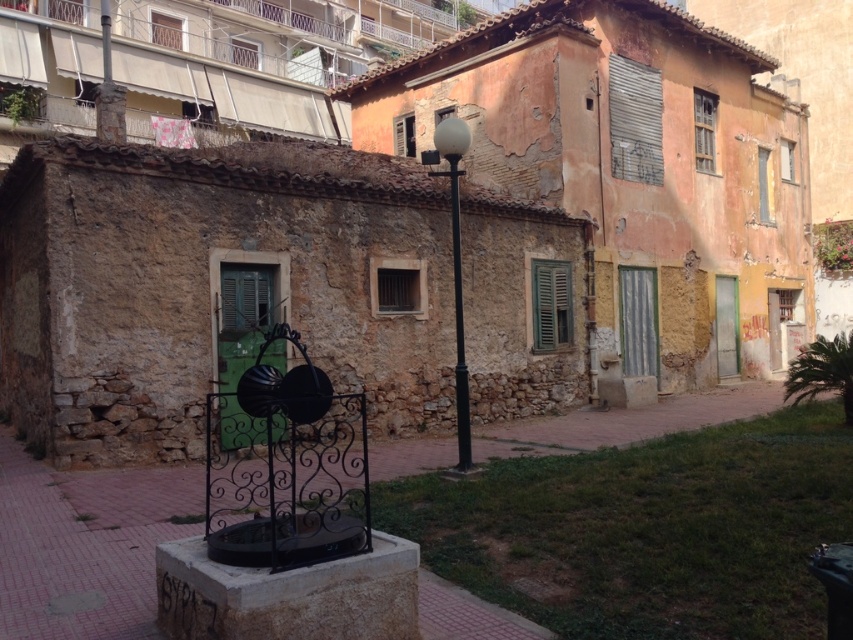
From the picture: You are standing in front of the weathered stone building with a rustic charm. You notice two points marked on the building wall. The first point is at coordinate (548, 340) and the second at (701, 164). Which point is closer to you?

Point (548, 340) is closer to the viewer than point (701, 164).

You are standing in the urban scene and want to take a photo of the wooden at upper right without the green wooden shutter at upper center blocking it. Is this possible?

The wooden at upper right is in front of the green wooden shutter at upper center, so it would block the view of the shutter. To capture the shutter without obstruction, you would need to position yourself so that the wooden structure is not between you and the shutter.

You are standing in front of the weathered stone building with green matte shutters at center and wooden at upper right. Which object is nearer to you?

The green matte shutters at center are closer to the viewer than the wooden at upper right.